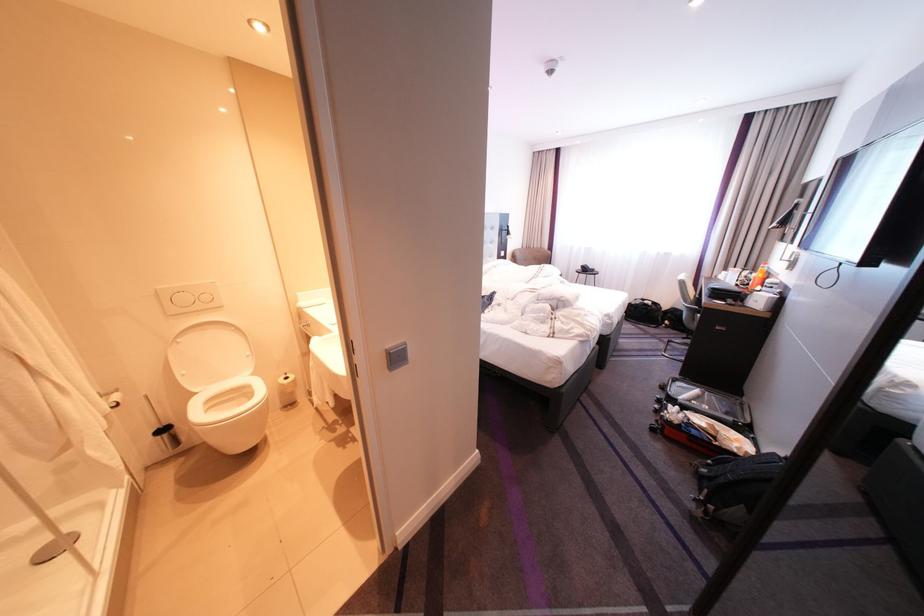
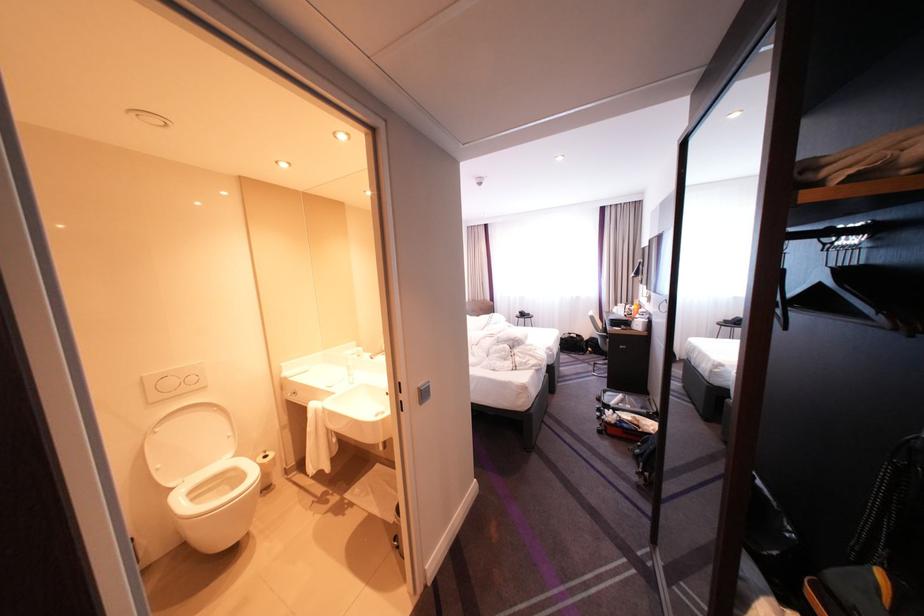
Where in the second image is the point corresponding to point (169, 296) from the first image?

(154, 384)